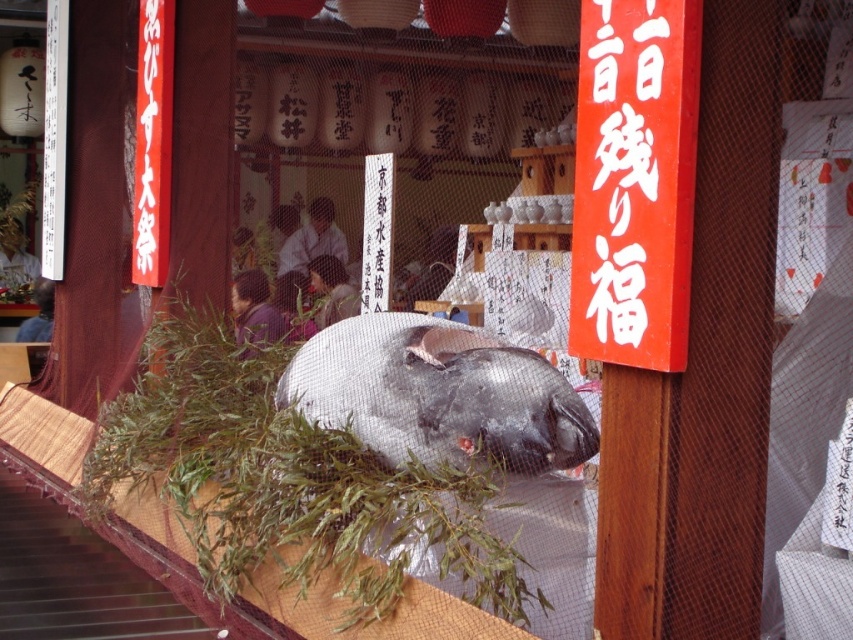
Is shiny silver fish at center to the right of white paper sign at upper center from the viewer's perspective?

Incorrect, shiny silver fish at center is not on the right side of white paper sign at upper center.

Is the position of shiny silver fish at center more distant than that of white paper sign at upper center?

That is True.

I want to click on shiny silver fish at center, so click(439, 394).

Find the location of a particular element. The height and width of the screenshot is (640, 853). shiny silver fish at center is located at coordinates (439, 394).